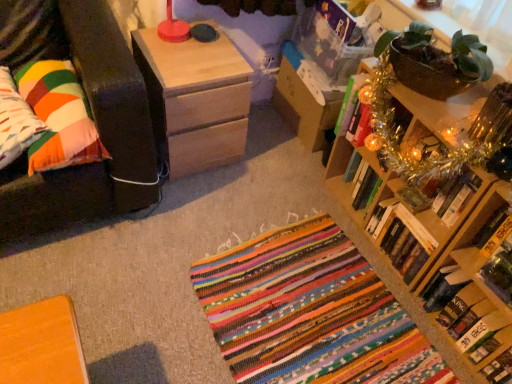
Locate an element on the screen. This screenshot has height=384, width=512. blank area beneath multicolored woven rug at center (from a real-world perspective) is located at coordinates (315, 312).